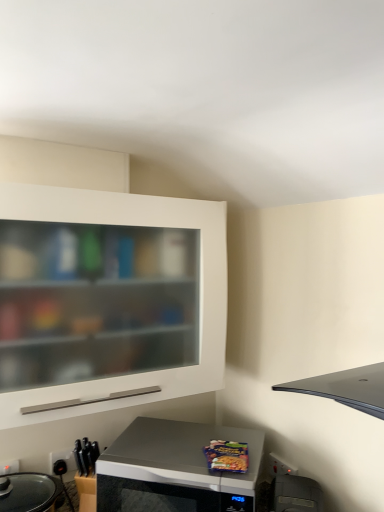
Question: Does point (226, 437) appear closer or farther from the camera than point (299, 502)?

Choices:
 (A) closer
 (B) farther

Answer: (B)

Question: Considering the positions of silver metallic microwave at lower center and black plastic toaster at lower right in the image, is silver metallic microwave at lower center taller or shorter than black plastic toaster at lower right?

Choices:
 (A) tall
 (B) short

Answer: (A)

Question: Which object is positioned closest to the white matte cabinet at upper left?

Choices:
 (A) silver metallic microwave at lower center
 (B) black plastic electric outlet at lower left
 (C) black plastic toaster at lower right

Answer: (A)

Question: Estimate the real-world distances between objects in this image. Which object is closer to the black plastic toaster at lower right?

Choices:
 (A) black plastic electric outlet at lower left
 (B) white matte cabinet at upper left
 (C) silver metallic microwave at lower center

Answer: (C)